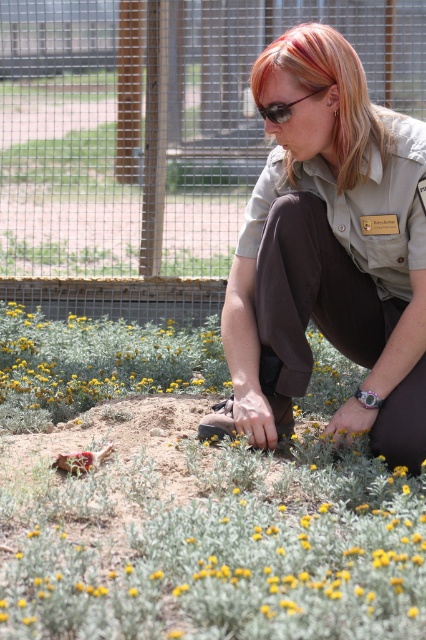
You are a park ranger observing a colleague from a distance. You notice the colleague has blonde hair at center and matte black sunglasses at center. Which object is positioned higher on the person?

The blonde hair at center is taller than matte black sunglasses at center, so the blonde hair at center is positioned higher on the person.

In the scene shown: Based on the scene description, where is the blonde hair at center located in terms of coordinates?

The blonde hair at center is located at coordinates point (324, 93).